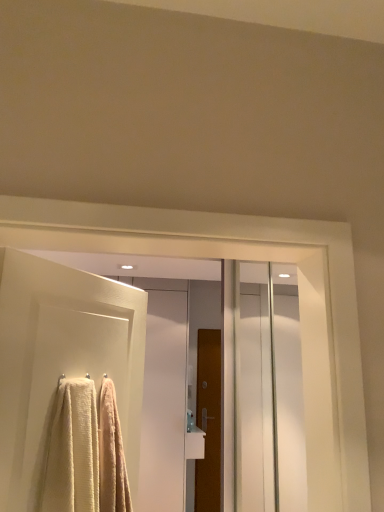
Question: In terms of height, does brown wooden door at center, placed as the first door when sorted from right to left, look taller or shorter compared to white textured towel at left, which ranks as the 2th door in right-to-left order?

Choices:
 (A) tall
 (B) short

Answer: (A)

Question: Is brown wooden door at center, the 2th door viewed from the top, spatially inside white textured towel at left, the first door in the front-to-back sequence, or outside of it?

Choices:
 (A) outside
 (B) inside

Answer: (A)

Question: Estimate the real-world distances between objects in this image. Which object is closer to the white glossy screen door at center?

Choices:
 (A) white textured towel at left, which is the first door in top-to-bottom order
 (B) brown wooden door at center, the first door when ordered from back to front
 (C) soft white towel at left

Answer: (B)

Question: Considering the real-world distances, which object is farthest from the white glossy screen door at center?

Choices:
 (A) brown wooden door at center, which ranks as the second door in left-to-right order
 (B) soft white towel at left
 (C) white textured towel at left, the first door in the front-to-back sequence

Answer: (B)